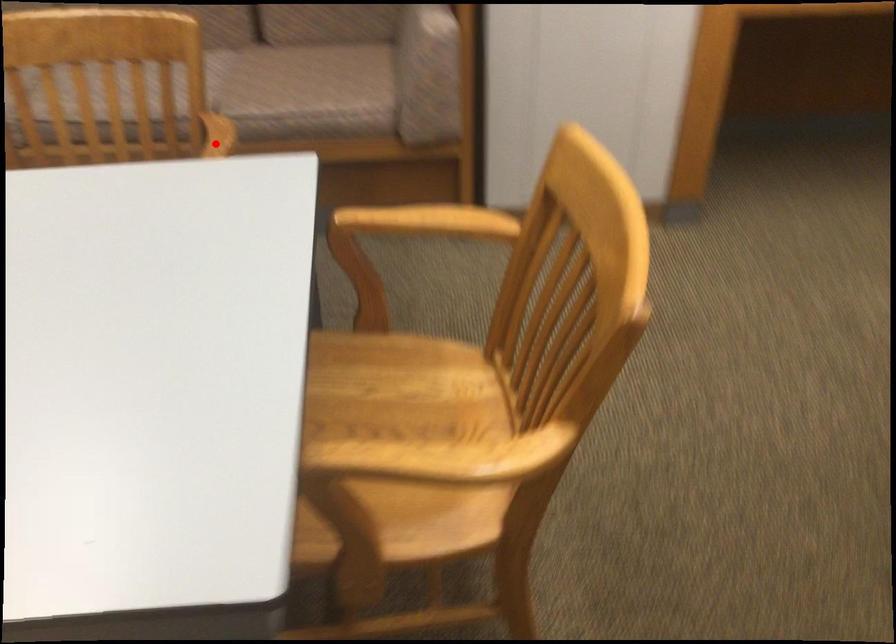
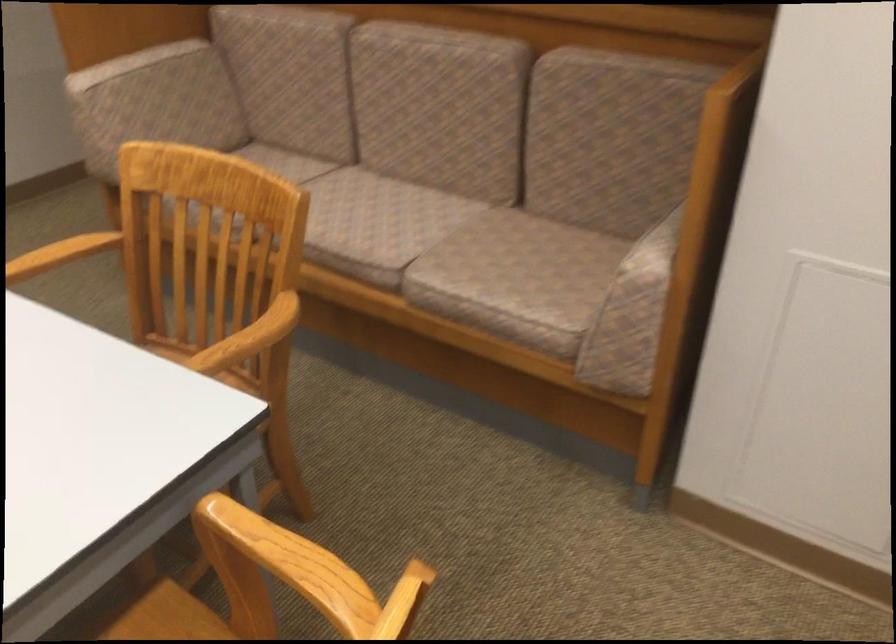
Question: I am providing you with two images of the same scene from different viewpoints. A red point is marked on the first image. Is the red point's position out of view in image 2?

Choices:
 (A) Yes
 (B) No

Answer: (B)